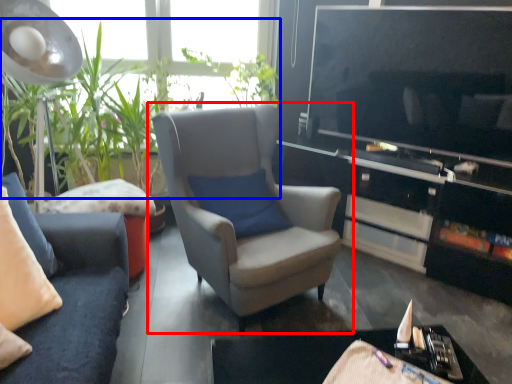
Question: Among these objects, which one is farthest to the camera, chair (highlighted by a red box) or vegetation (highlighted by a blue box)?

Choices:
 (A) chair
 (B) vegetation

Answer: (B)